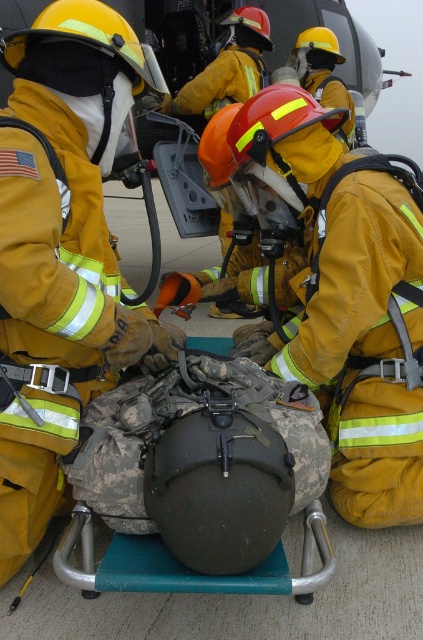
Question: Considering the real-world distances, which object is closest to the camouflage helmet at center?

Choices:
 (A) yellow reflective uniform at center
 (B) orange reflective helmet at center
 (C) yellow reflective helmet at center

Answer: (A)

Question: Observing the image, what is the correct spatial positioning of camouflage helmet at center in reference to orange reflective helmet at center?

Choices:
 (A) above
 (B) below

Answer: (B)

Question: Does camouflage helmet at center have a larger size compared to orange reflective helmet at center?

Choices:
 (A) no
 (B) yes

Answer: (B)

Question: Which of the following is the farthest from the observer?

Choices:
 (A) orange reflective helmet at center
 (B) yellow reflective uniform at center

Answer: (A)

Question: Can you confirm if camouflage helmet at center is positioned to the right of orange reflective helmet at center?

Choices:
 (A) no
 (B) yes

Answer: (B)

Question: Which point appears closest to the camera in this image?

Choices:
 (A) (209, 64)
 (B) (324, 36)
 (C) (85, 211)

Answer: (C)